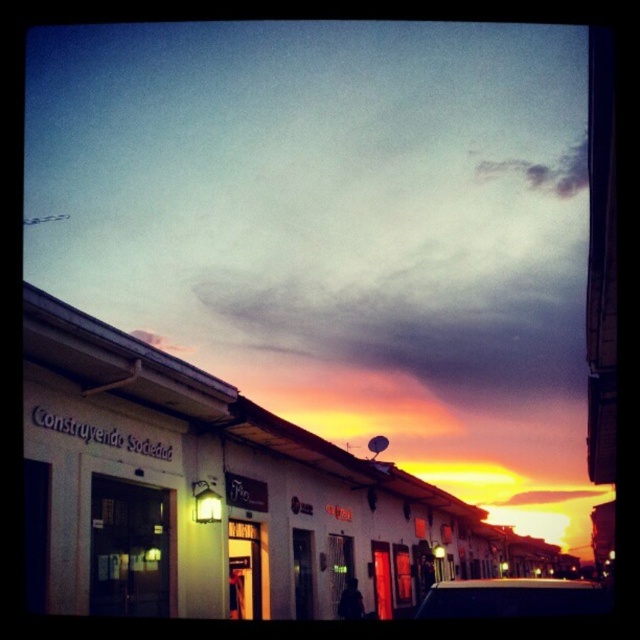
You are standing on the street looking at the sunset scene. There is a point marked at coordinates (400,276). Based on the scene description, can you tell me what part of the image this point is located in?

The point at coordinates (400,276) is located in the cloudy sky at upper center.

You are a photographer trying to capture the sunset reflection on the white glossy car at lower center. To ensure the cloudy sky at upper center is also visible in the reflection, where should you position yourself relative to the car?

The cloudy sky at upper center is located above the white glossy car at lower center, so you should position yourself in front of the car at a low angle to capture the reflection of the sky on the car.